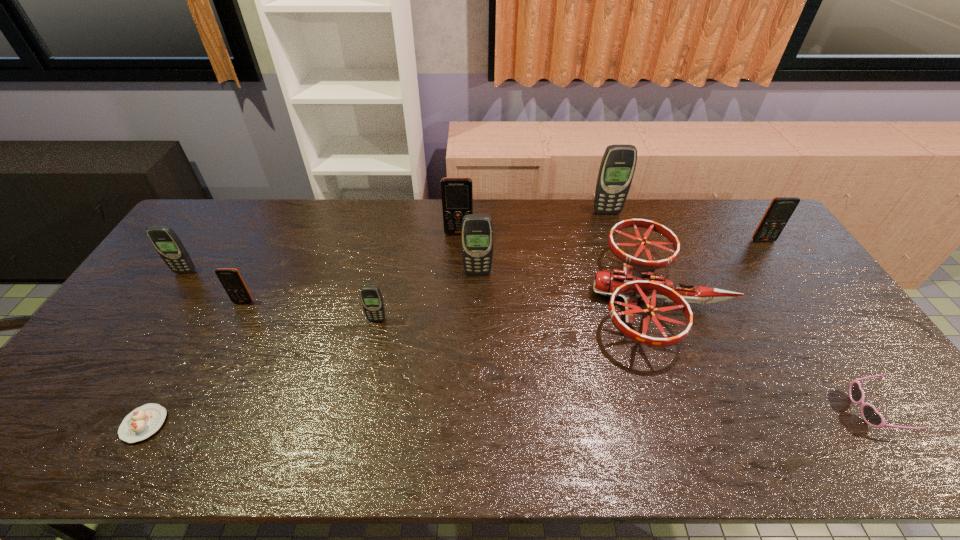
Find the location of `free space that satisfies the following two spatial constraints: 1. on the screen of the ninth nearest object; 2. on the left side of the red drone`. free space that satisfies the following two spatial constraints: 1. on the screen of the ninth nearest object; 2. on the left side of the red drone is located at coordinates (455, 298).

The width and height of the screenshot is (960, 540). Identify the location of vacant area in the image that satisfies the following two spatial constraints: 1. on the screen of the cupcake; 2. on the left side of the second smallest gray cellular telephone. (83, 424).